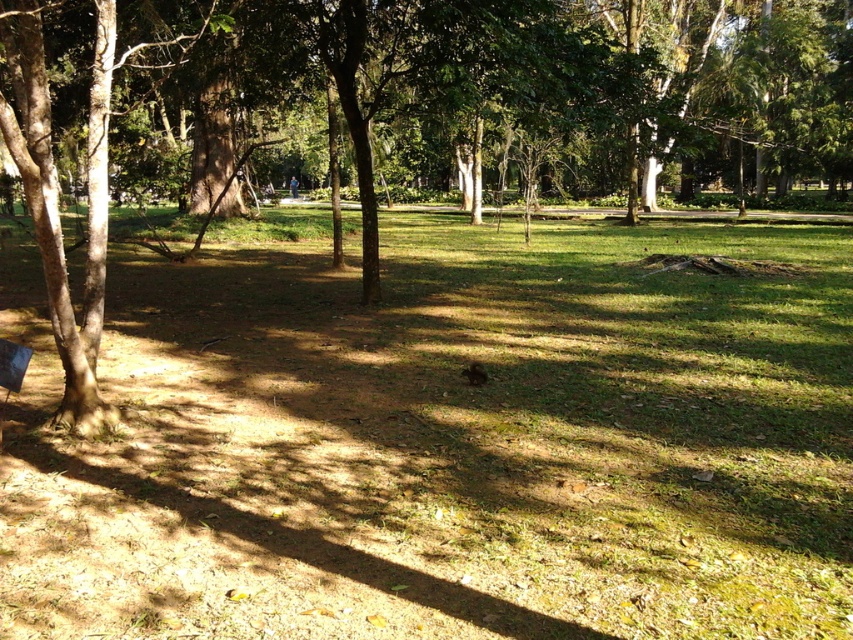
You are standing in the park and want to take a photo of the green grassy at center and the brown textured tree at center. Which object should you place on the left side of your camera frame to ensure both are visible?

You should place the brown textured tree at center on the left side of your camera frame because the green grassy at center is positioned on the right side of it, ensuring both are visible in the frame.

You are standing at the origin point of the coordinate system. You want to walk to the green grassy at center. Which direction should you move in terms of x and y coordinates?

The green grassy at center is located at coordinate point 0.694 in the x direction and 0.524 in the y direction. Therefore, you should move in the positive x and positive y direction to reach it.

You are a gardener planning to mow the green grassy at center and trim the brown textured tree at center. Which task requires more time due to the size difference between the two?

The brown textured tree at center requires more time to trim because it has a greater width than the green grassy at center.